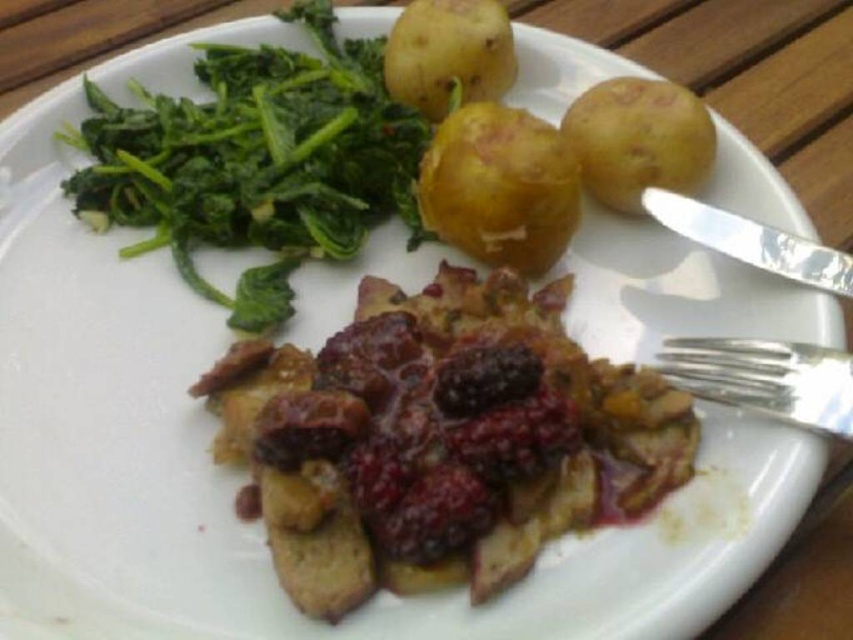
Does yellow matte potato at upper center appear on the right side of silver metallic fork at right?

No, yellow matte potato at upper center is not to the right of silver metallic fork at right.

Is yellow matte potato at upper center below silver metallic fork at right?

No, yellow matte potato at upper center is not below silver metallic fork at right.

Does point (548, 259) come closer to viewer compared to point (724, 372)?

No, (548, 259) is behind (724, 372).

Find the location of `yellow matte potato at upper center`. yellow matte potato at upper center is located at coordinates (500, 186).

What do you see at coordinates (637, 140) in the screenshot? I see `smooth yellow potato at upper right` at bounding box center [637, 140].

Is smooth yellow potato at upper right thinner than silver metallic knife at right?

Correct, smooth yellow potato at upper right's width is less than silver metallic knife at right's.

You are a GUI agent. You are given a task and a screenshot of the screen. Output one action in this format:
    pyautogui.click(x=<x>, y=<y>)
    Task: Click on the smooth yellow potato at upper right
    
    Given the screenshot: What is the action you would take?
    pyautogui.click(x=637, y=140)

Image resolution: width=853 pixels, height=640 pixels. Find the location of `smooth yellow potato at upper right`. smooth yellow potato at upper right is located at coordinates (637, 140).

Can you confirm if smooth yellow potato at upper right is positioned below smooth yellow potato at upper center?

Yes, smooth yellow potato at upper right is below smooth yellow potato at upper center.

Which is in front, point (589, 179) or point (438, 13)?

Positioned in front is point (589, 179).

Where is `smooth yellow potato at upper right`? smooth yellow potato at upper right is located at coordinates (637, 140).